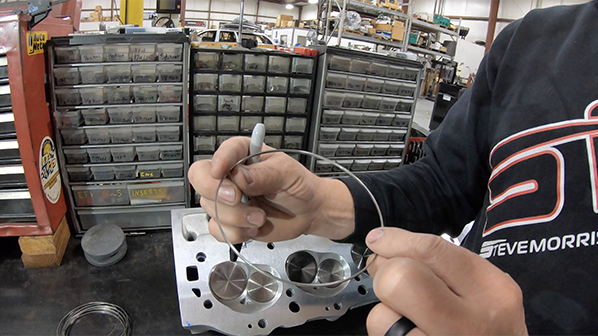
At what (x,y) coordinates should I click in order to perform the action: click on ceiling light. Please return your answer as a coordinate pair (x, y). Looking at the image, I should click on (313, 0).